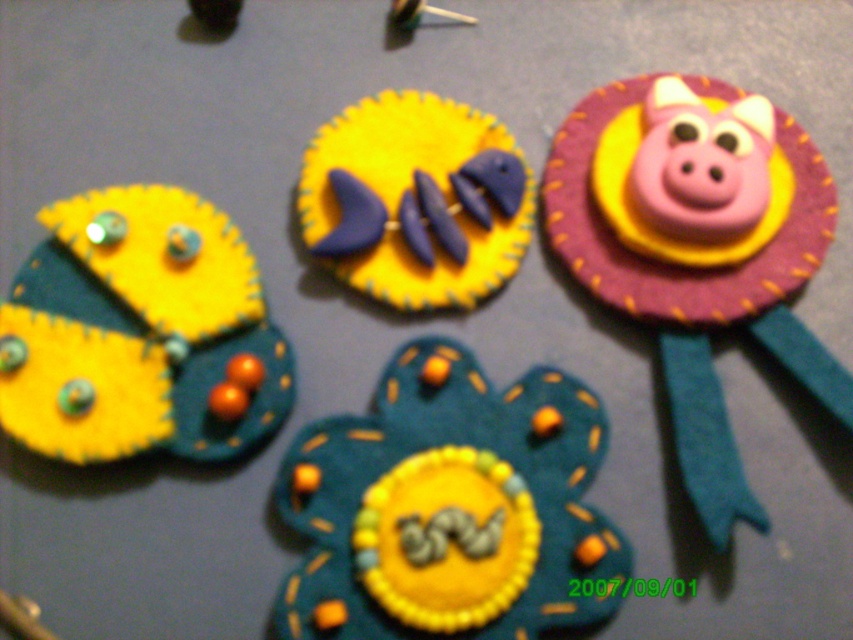
Which is more to the left, pink felt ribbon at upper right or yellow felt butterfly at left?

Positioned to the left is yellow felt butterfly at left.

Describe the element at coordinates (695, 212) in the screenshot. I see `pink felt ribbon at upper right` at that location.

The image size is (853, 640). I want to click on pink felt ribbon at upper right, so click(695, 212).

Can you confirm if teal felt flower at center is positioned to the left of pink felt ribbon at upper right?

Indeed, teal felt flower at center is positioned on the left side of pink felt ribbon at upper right.

Can you confirm if teal felt flower at center is bigger than pink felt ribbon at upper right?

No, teal felt flower at center is not bigger than pink felt ribbon at upper right.

Which is in front, point (564, 522) or point (567, 220)?

Positioned in front is point (564, 522).

Locate an element on the screen. Image resolution: width=853 pixels, height=640 pixels. teal felt flower at center is located at coordinates (450, 508).

Is point (564, 396) farther from viewer compared to point (467, 202)?

No, (564, 396) is closer to viewer.

Who is shorter, teal felt flower at center or yellow felt fish at center?

With less height is yellow felt fish at center.

Describe the element at coordinates (450, 508) in the screenshot. The width and height of the screenshot is (853, 640). I see `teal felt flower at center` at that location.

I want to click on teal felt flower at center, so click(450, 508).